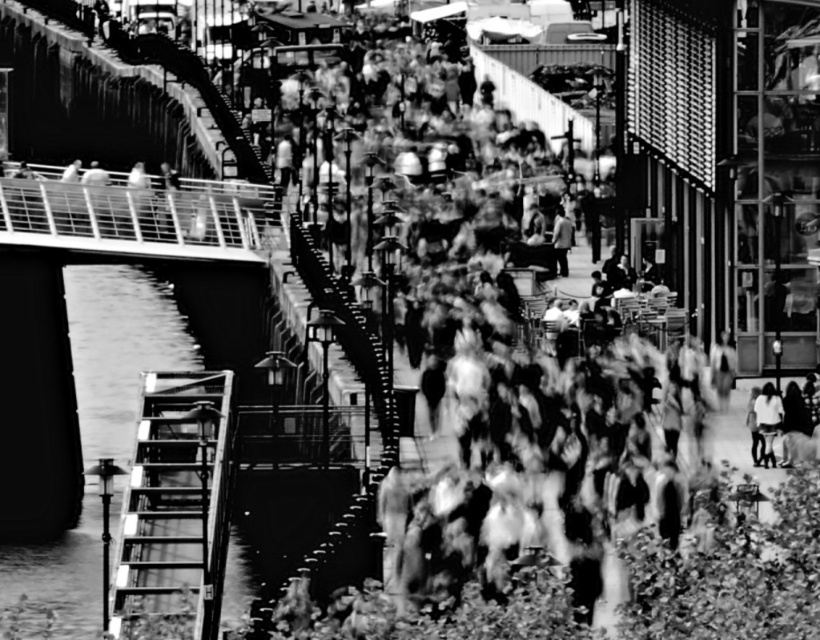
Question: Can you confirm if metallic ladder at left is thinner than light gray fabric jacket at lower right?

Choices:
 (A) yes
 (B) no

Answer: (B)

Question: Does metallic ladder at left appear over light gray fabric jacket at lower right?

Choices:
 (A) no
 (B) yes

Answer: (A)

Question: Which object is farther from the camera taking this photo?

Choices:
 (A) metallic ladder at left
 (B) light gray fabric jacket at lower right

Answer: (B)

Question: Can you confirm if metallic ladder at left is smaller than light gray fabric jacket at lower right?

Choices:
 (A) no
 (B) yes

Answer: (A)